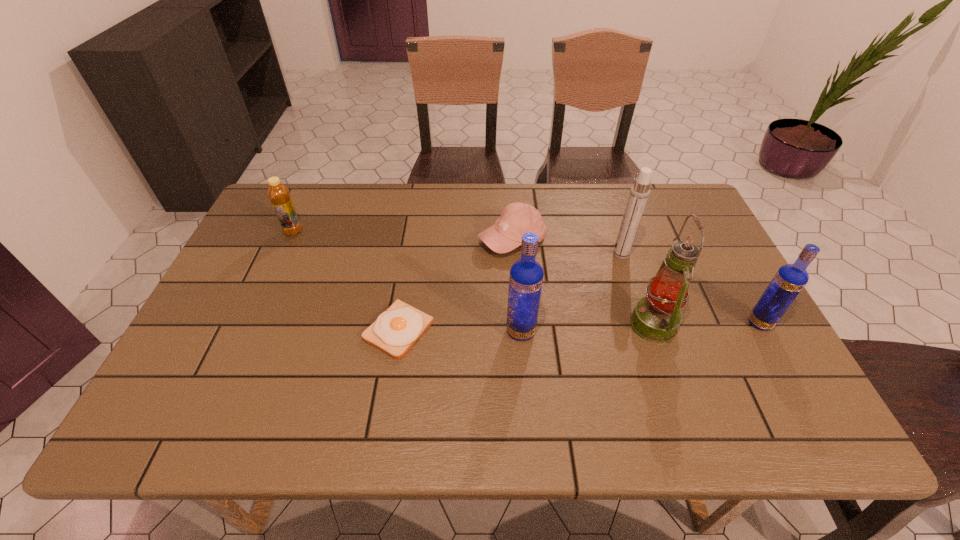
Please point a spot on the left to add another vodka. Please provide its 2D coordinates. Your answer should be formatted as a tuple, i.e. [(x, y)], where the tuple contains the x and y coordinates of a point satisfying the conditions above.

[(274, 340)]